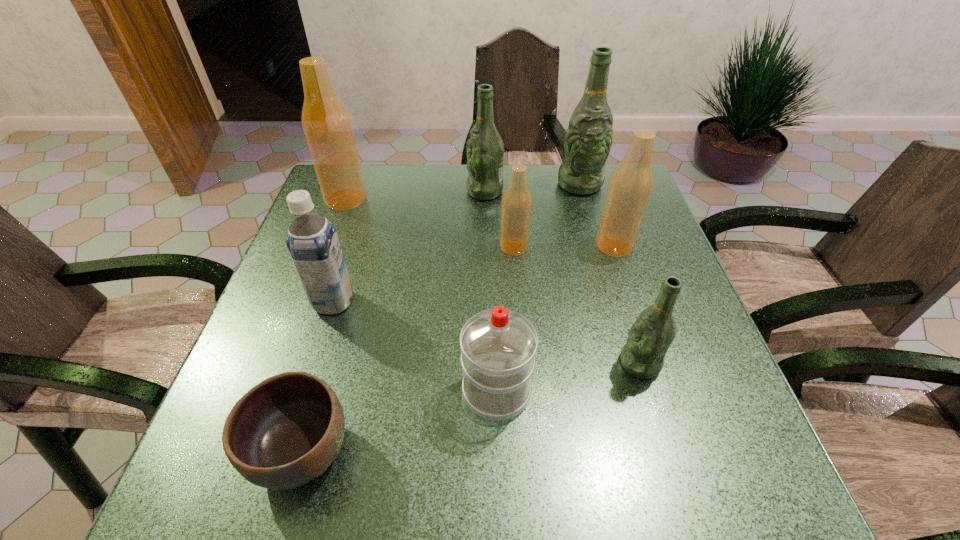
This screenshot has width=960, height=540. In order to click on free area in between the farthest tan beer bottle and the second smallest tan beer bottle in this screenshot , I will do `click(480, 222)`.

I want to click on empty space between the farthest tan beer bottle and the nearest green beer bottle, so click(492, 281).

Locate an element on the screen. This screenshot has height=540, width=960. free area in between the biggest green beer bottle and the shortest object is located at coordinates (441, 318).

Locate an element on the screen. Image resolution: width=960 pixels, height=540 pixels. vacant area that lies between the biggest green beer bottle and the white water bottle is located at coordinates (538, 288).

This screenshot has width=960, height=540. I want to click on empty space that is in between the rightmost tan beer bottle and the leftmost tan beer bottle, so click(480, 222).

This screenshot has width=960, height=540. Find the location of `vacant region between the biggest green beer bottle and the sixth farthest object`. vacant region between the biggest green beer bottle and the sixth farthest object is located at coordinates (457, 243).

Where is `vacant space that is in between the leftmost tan beer bottle and the rightmost tan beer bottle`? This screenshot has width=960, height=540. vacant space that is in between the leftmost tan beer bottle and the rightmost tan beer bottle is located at coordinates (480, 222).

I want to click on the fourth closest object to the leftmost green beer bottle, so click(326, 123).

Locate an element on the screen. object that stands as the closest to the rightmost tan beer bottle is located at coordinates (588, 139).

The height and width of the screenshot is (540, 960). I want to click on beer bottle that is the fourth closest one to the biggest tan beer bottle, so tap(631, 183).